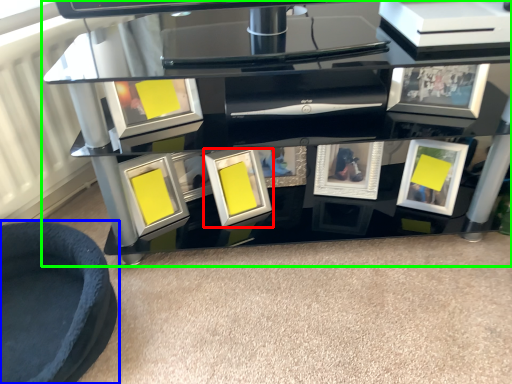
Question: Estimate the real-world distances between objects in this image. Which object is farther from picture frame (highlighted by a red box), furniture (highlighted by a blue box) or table (highlighted by a green box)?

Choices:
 (A) furniture
 (B) table

Answer: (A)